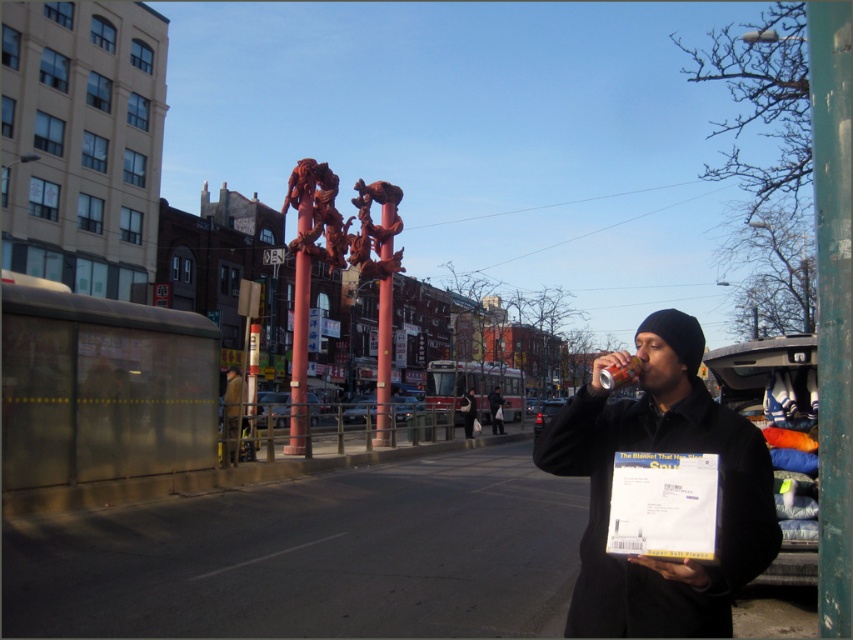
Question: Among these objects, which one is farthest from the camera?

Choices:
 (A) black knit cap at upper right
 (B) matte black beanie at upper right
 (C) black knit hat at center
 (D) dark brown leather jacket at center

Answer: (A)

Question: Is matte black beanie at upper right to the left of black knit hat at center from the viewer's perspective?

Choices:
 (A) no
 (B) yes

Answer: (A)

Question: Which point appears farthest from the camera in this image?

Choices:
 (A) (490, 419)
 (B) (593, 420)
 (C) (238, 396)
 (D) (468, 394)

Answer: (A)

Question: Is matte black beanie at upper right smaller than black knit cap at upper right?

Choices:
 (A) yes
 (B) no

Answer: (B)

Question: Is matte black beanie at upper right behind black knit hat at center?

Choices:
 (A) no
 (B) yes

Answer: (A)

Question: Which of these objects is positioned farthest from the black knit cap at upper right?

Choices:
 (A) matte black beanie at upper right
 (B) black knit hat at center

Answer: (A)